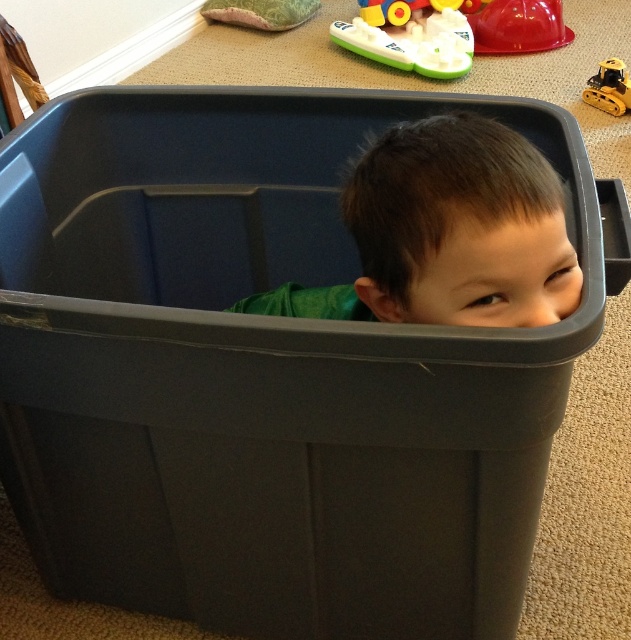
Question: Is green plastic boat at upper center above yellow plastic toy at upper center?

Choices:
 (A) no
 (B) yes

Answer: (A)

Question: Considering the real-world distances, which object is closest to the shiny plastic bowl at upper right?

Choices:
 (A) dark green hair at upper center
 (B) yellow rubber toy at upper center
 (C) green plastic boat at upper center

Answer: (C)

Question: Which object is closer to the camera taking this photo?

Choices:
 (A) dark green hair at upper center
 (B) yellow plastic toy at upper center
 (C) green plastic boat at upper center

Answer: (A)

Question: Is yellow plastic toy at upper center further to camera compared to yellow rubber toy at upper center?

Choices:
 (A) no
 (B) yes

Answer: (B)

Question: Observing the image, what is the correct spatial positioning of green plastic boat at upper center in reference to yellow plastic toy at upper center?

Choices:
 (A) right
 (B) left

Answer: (B)

Question: Which point is farther from the camera taking this photo?

Choices:
 (A) click(x=456, y=8)
 (B) click(x=516, y=22)
 (C) click(x=610, y=83)
 (D) click(x=432, y=186)

Answer: (A)